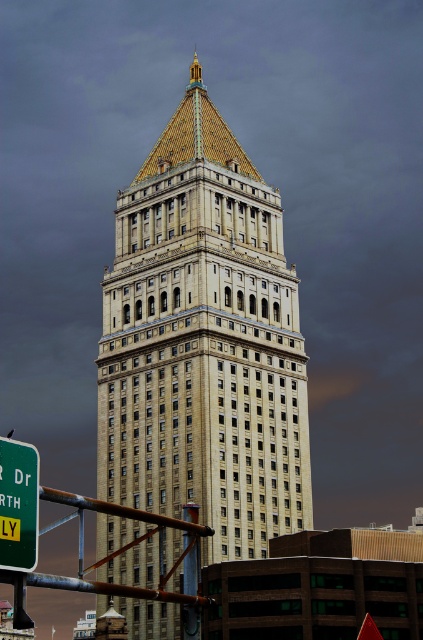
Question: Which of the following is the farthest from the observer?

Choices:
 (A) green plastic sign at lower left
 (B) beige stone tower at center

Answer: (B)

Question: Is beige stone tower at center further to camera compared to green plastic sign at lower left?

Choices:
 (A) yes
 (B) no

Answer: (A)

Question: Does beige stone tower at center have a larger size compared to green plastic sign at lower left?

Choices:
 (A) no
 (B) yes

Answer: (B)

Question: Among these points, which one is nearest to the camera?

Choices:
 (A) (277, 321)
 (B) (18, 481)

Answer: (B)

Question: Is beige stone tower at center bigger than green plastic sign at lower left?

Choices:
 (A) yes
 (B) no

Answer: (A)

Question: Among these points, which one is farthest from the camera?

Choices:
 (A) (250, 208)
 (B) (33, 552)

Answer: (A)